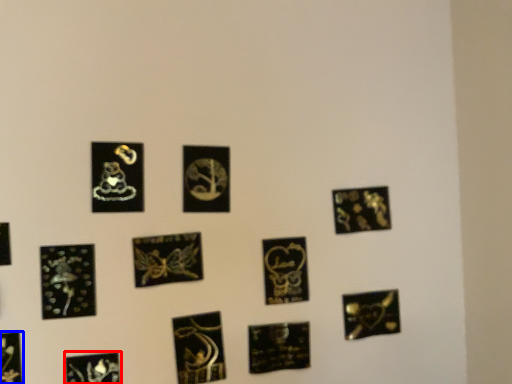
Question: Which object appears closest to the camera in this image, picture frame (highlighted by a red box) or picture frame (highlighted by a blue box)?

Choices:
 (A) picture frame
 (B) picture frame

Answer: (B)